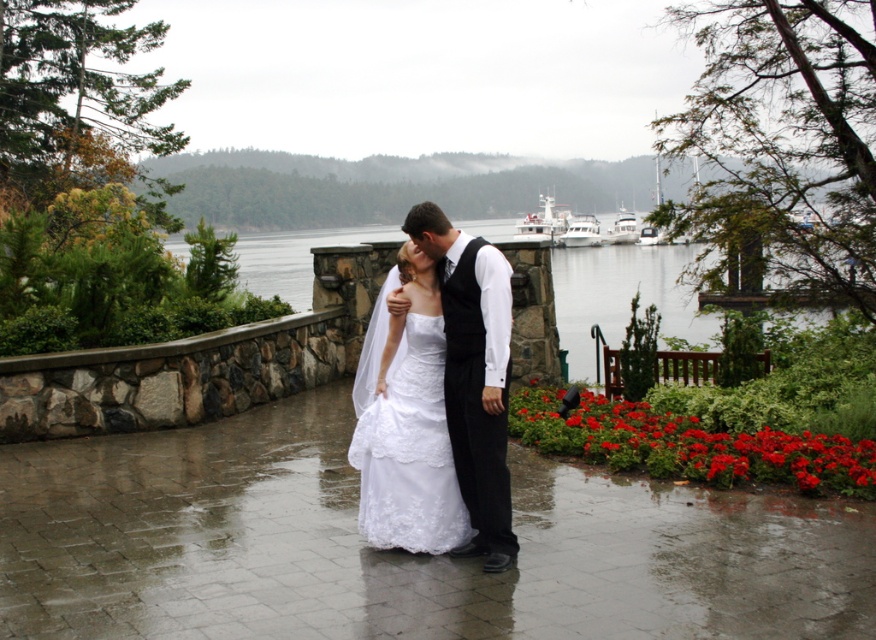
Does point (468, 552) come closer to viewer compared to point (583, 230)?

Yes, it is.

Locate an element on the screen. The width and height of the screenshot is (876, 640). black satin vest at center is located at coordinates (474, 374).

Is point (493, 454) closer to camera compared to point (581, 221)?

Yes, it is in front of point (581, 221).

Find the location of a particular element. The width and height of the screenshot is (876, 640). black satin vest at center is located at coordinates (474, 374).

Does black satin vest at center have a greater width compared to clear water at center?

No.

The image size is (876, 640). I want to click on black satin vest at center, so tap(474, 374).

Is point (493, 483) farther from camera compared to point (641, 252)?

No, it is in front of (641, 252).

Where is `black satin vest at center`? black satin vest at center is located at coordinates (474, 374).

Is point (594, 278) more distant than point (569, 232)?

No, (594, 278) is in front of (569, 232).

Who is positioned more to the right, clear water at center or white glossy boat at upper center?

From the viewer's perspective, white glossy boat at upper center appears more on the right side.

Is point (662, 328) farther from camera compared to point (590, 244)?

That is False.

The image size is (876, 640). Find the location of `clear water at center`. clear water at center is located at coordinates (620, 296).